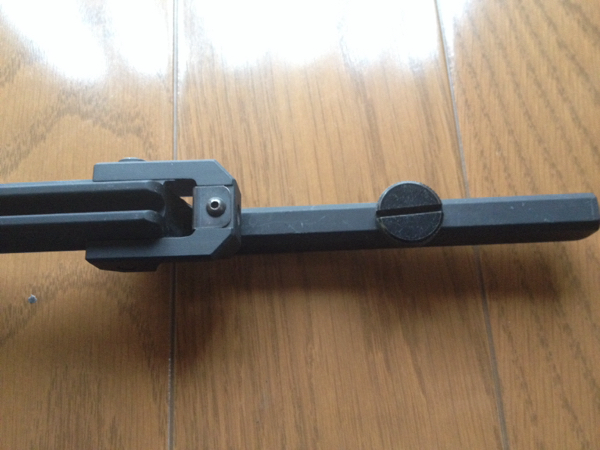
At what (x,y) coordinates should I click in order to perform the action: click on floor. Please return your answer as a coordinate pair (x, y). The image size is (600, 450). Looking at the image, I should click on (559, 54).